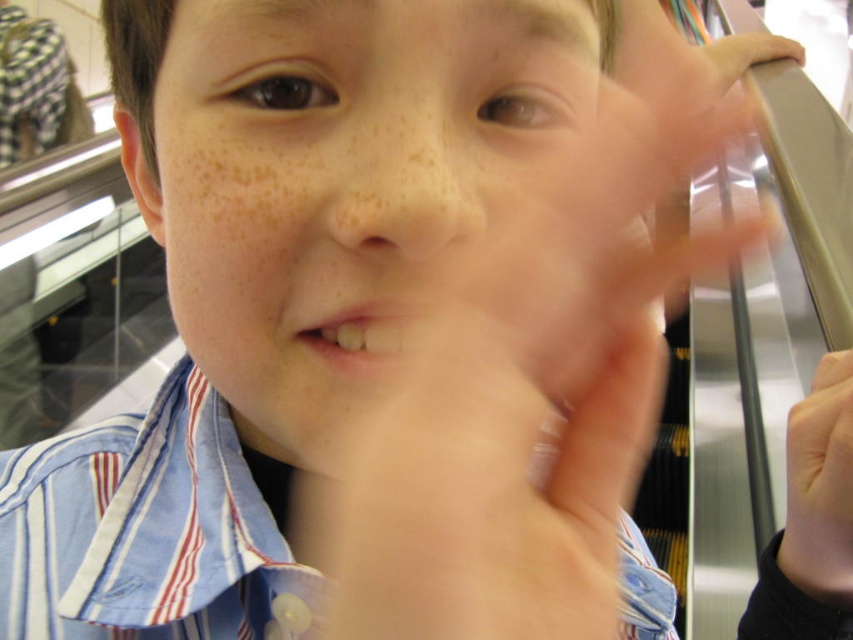
Based on the photo, is the position of smooth skin face at center less distant than that of smooth skin hand at lower right?

Yes, smooth skin face at center is in front of smooth skin hand at lower right.

Is smooth skin face at center below smooth skin hand at lower right?

No.

In the scene shown: Measure the distance between point (x=238, y=298) and camera.

A distance of 11.51 inches exists between point (x=238, y=298) and camera.

Locate an element on the screen. Image resolution: width=853 pixels, height=640 pixels. smooth skin face at center is located at coordinates (338, 177).

Does blue striped shirt at center have a greater width compared to smooth skin hand at lower right?

Yes.

Does blue striped shirt at center appear on the left side of smooth skin hand at lower right?

Indeed, blue striped shirt at center is positioned on the left side of smooth skin hand at lower right.

Which is in front, point (4, 458) or point (817, 541)?

Point (817, 541)

I want to click on blue striped shirt at center, so click(x=148, y=531).

Does smooth skin face at center have a smaller size compared to blue striped shirt at center?

Correct, smooth skin face at center occupies less space than blue striped shirt at center.

Is smooth skin face at center below blue striped shirt at center?

Incorrect, smooth skin face at center is not positioned below blue striped shirt at center.

Which is behind, point (398, 237) or point (254, 548)?

The point (254, 548) is more distant.

Locate an element on the screen. smooth skin face at center is located at coordinates (338, 177).